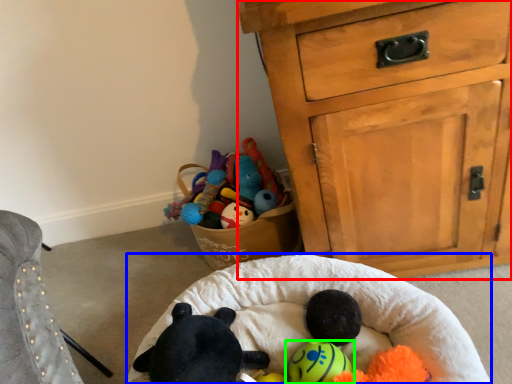
Question: Which is nearer to the chest of drawers (highlighted by a red box)? infant bed (highlighted by a blue box) or toy (highlighted by a green box).

Choices:
 (A) infant bed
 (B) toy

Answer: (A)